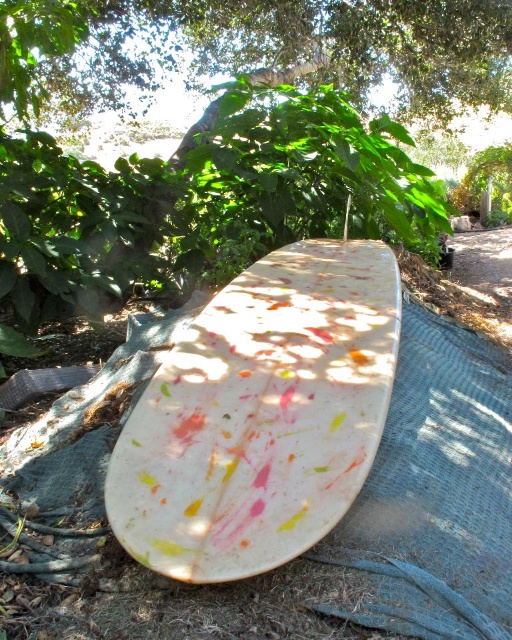
You are a photographer trying to capture the surfboard without the tree in the background. Based on the scene, can you position yourself so that the green leafy tree at center is not visible behind the painted wood surfboard at center?

Yes, since the painted wood surfboard at center is in front of the green leafy tree at center, positioning yourself directly in front of the surfboard would block the view of the tree behind it, making it invisible in the photo.

You are standing in a shaded area surrounded by lush green foliage. You see a surfboard lying on a textured dark gray tarp on the ground. Where is the surfboard located relative to the point marked at coordinates (261, 416)?

The surfboard is located exactly at the point marked at coordinates (261, 416).